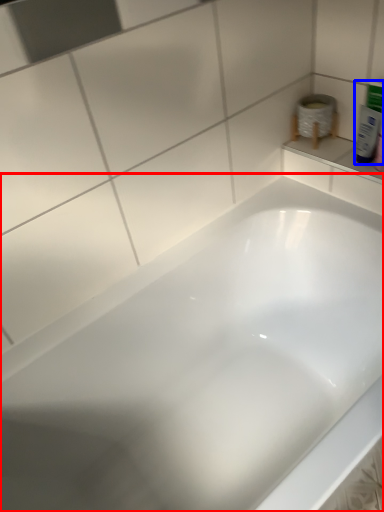
Question: Which point is closer to the camera, bathtub (highlighted by a red box) or mouthwash (highlighted by a blue box)?

Choices:
 (A) bathtub
 (B) mouthwash

Answer: (A)